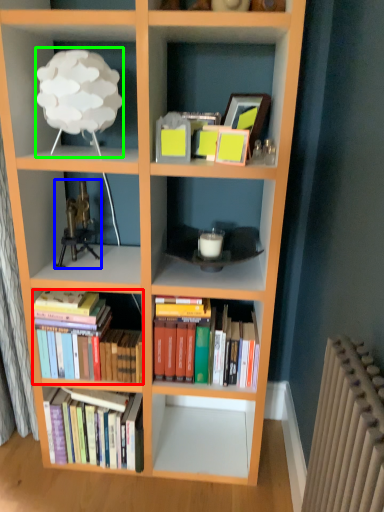
Question: Estimate the real-world distances between objects in this image. Which object is closer to book (highlighted by a red box), toy (highlighted by a blue box) or lamp (highlighted by a green box)?

Choices:
 (A) toy
 (B) lamp

Answer: (A)